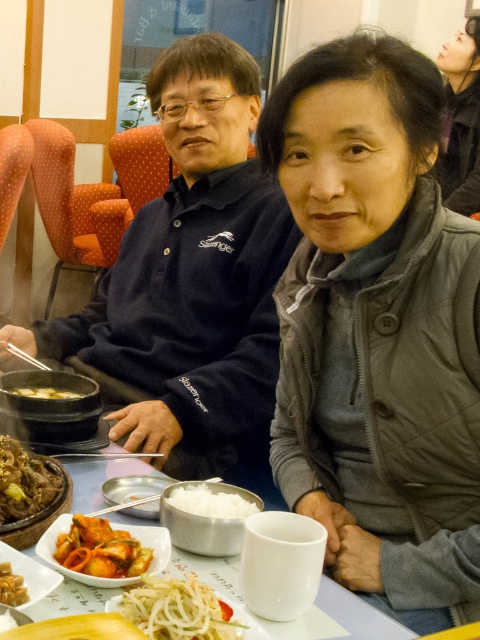
Question: Is vibrant orange sauce at center to the left of white matte rice at center from the viewer's perspective?

Choices:
 (A) yes
 (B) no

Answer: (A)

Question: Which point is farther from the camera taking this photo?

Choices:
 (A) (126, 502)
 (B) (337, 609)
 (C) (50, 396)

Answer: (C)

Question: Which object appears closest to the camera in this image?

Choices:
 (A) white matte rice at center
 (B) matte black bowl at center
 (C) navy blue polo shirt at center

Answer: (A)

Question: Which object is farther from the camera taking this photo?

Choices:
 (A) vibrant orange sauce at center
 (B) matte gray jacket at upper center
 (C) white glossy mug at center

Answer: (B)

Question: Can you confirm if white glossy mug at center is thinner than brown clay pot at lower left?

Choices:
 (A) no
 (B) yes

Answer: (A)

Question: Does white glossy mug at center have a greater width compared to yellow matte noodles at lower center?

Choices:
 (A) yes
 (B) no

Answer: (A)